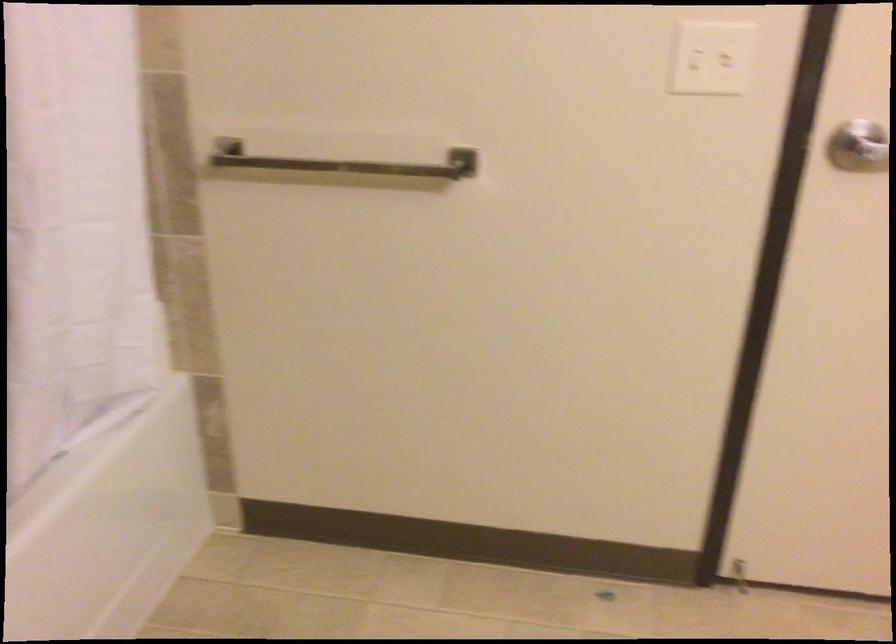
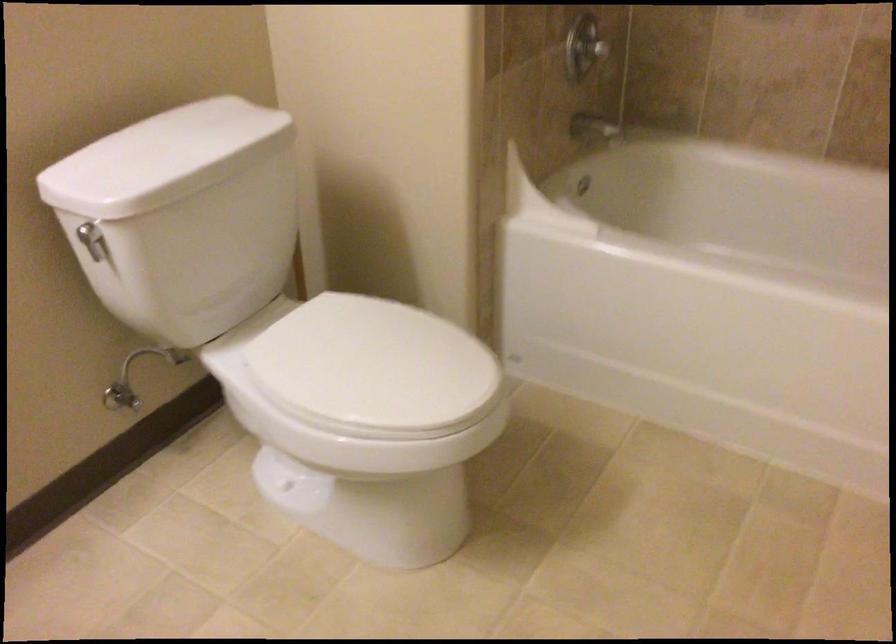
First-person continuous shooting, in which direction is the camera rotating?

The rotation direction of the camera is left-down.